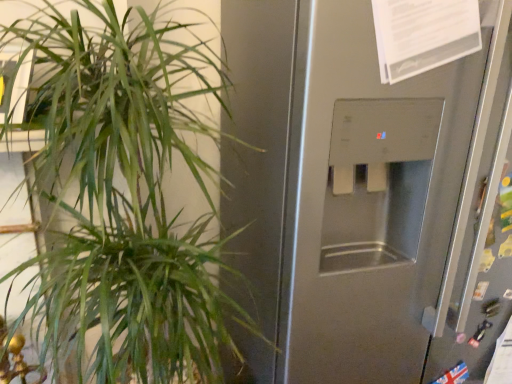
Question: Considering the relative sizes of green leafy plant at left and satin silver dispenser at center in the image provided, is green leafy plant at left taller than satin silver dispenser at center?

Choices:
 (A) no
 (B) yes

Answer: (A)

Question: Can you confirm if green leafy plant at left is positioned to the left of satin silver dispenser at center?

Choices:
 (A) yes
 (B) no

Answer: (A)

Question: From a real-world perspective, is green leafy plant at left beneath satin silver dispenser at center?

Choices:
 (A) yes
 (B) no

Answer: (B)

Question: Is green leafy plant at left to the right of satin silver dispenser at center from the viewer's perspective?

Choices:
 (A) yes
 (B) no

Answer: (B)

Question: From a real-world perspective, is green leafy plant at left located higher than satin silver dispenser at center?

Choices:
 (A) yes
 (B) no

Answer: (A)

Question: Is green leafy plant at left located outside satin silver dispenser at center?

Choices:
 (A) yes
 (B) no

Answer: (A)

Question: Is satin silver dispenser at center bigger than green leafy plant at left?

Choices:
 (A) no
 (B) yes

Answer: (B)

Question: Can you see satin silver dispenser at center touching green leafy plant at left?

Choices:
 (A) yes
 (B) no

Answer: (B)

Question: From a real-world perspective, is satin silver dispenser at center physically above green leafy plant at left?

Choices:
 (A) no
 (B) yes

Answer: (A)

Question: Is green leafy plant at left inside satin silver dispenser at center?

Choices:
 (A) yes
 (B) no

Answer: (B)

Question: Considering the relative sizes of satin silver dispenser at center and green leafy plant at left in the image provided, is satin silver dispenser at center shorter than green leafy plant at left?

Choices:
 (A) yes
 (B) no

Answer: (B)

Question: Does satin silver dispenser at center lie in front of green leafy plant at left?

Choices:
 (A) no
 (B) yes

Answer: (A)

Question: In terms of size, does satin silver dispenser at center appear bigger or smaller than green leafy plant at left?

Choices:
 (A) big
 (B) small

Answer: (A)